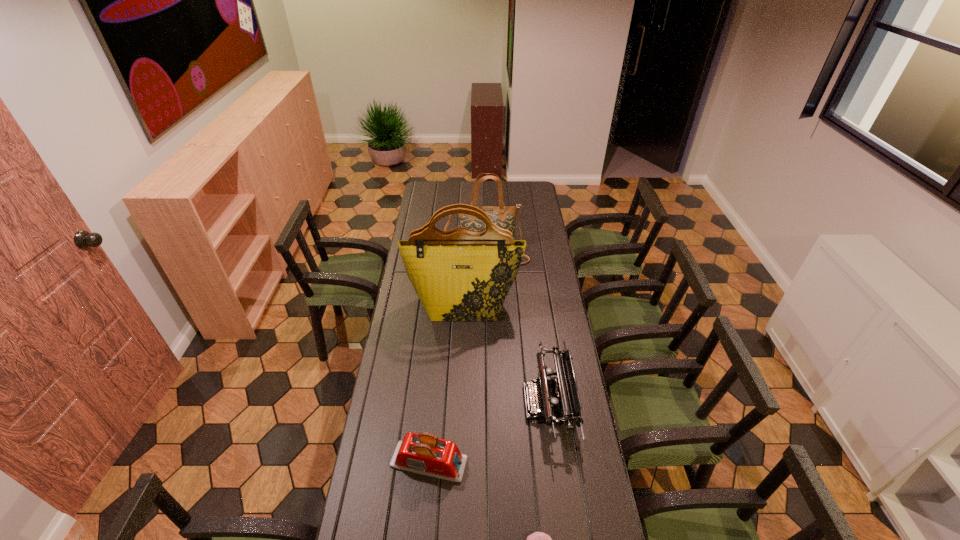
Image resolution: width=960 pixels, height=540 pixels. I want to click on free spot located 0.370m on the typing side of the typewriter, so coord(423,402).

Identify the location of free region located on the right of the toaster. (543, 462).

This screenshot has width=960, height=540. Identify the location of tote bag that is at the left edge. (459, 275).

Locate an element on the screen. toaster at the left edge is located at coordinates (424, 453).

Locate an element on the screen. The image size is (960, 540). handbag located at the right edge is located at coordinates (503, 216).

What are the coordinates of `typewriter that is at the right edge` in the screenshot? It's located at (567, 406).

You are a GUI agent. You are given a task and a screenshot of the screen. Output one action in this format:
    pyautogui.click(x=<x>, y=<y>)
    Task: Click on the vacant space at the far edge
    This screenshot has width=960, height=540.
    Given the screenshot: What is the action you would take?
    pyautogui.click(x=467, y=186)

Find the location of a particular element. This screenshot has width=960, height=540. vacant point at the left edge is located at coordinates (412, 359).

Where is `free space at the right edge`? This screenshot has width=960, height=540. free space at the right edge is located at coordinates point(527,210).

Identify the location of vacant space at the far left corner of the desktop. The width and height of the screenshot is (960, 540). (443, 191).